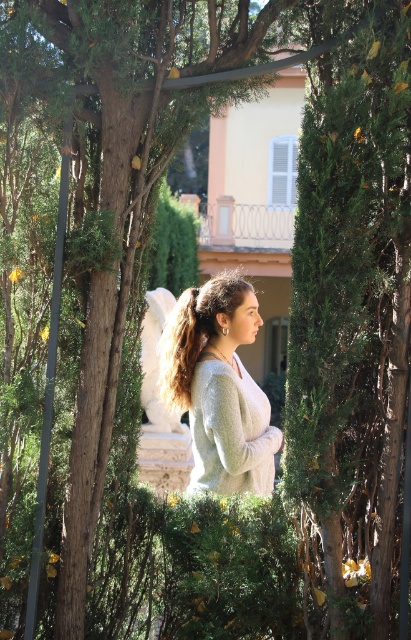
Question: Does light gray sweater at center appear on the right side of light gray knitted sweater at center?

Choices:
 (A) yes
 (B) no

Answer: (B)

Question: Is light gray sweater at center to the right of light gray knitted sweater at center from the viewer's perspective?

Choices:
 (A) yes
 (B) no

Answer: (B)

Question: Which point is closer to the camera?

Choices:
 (A) light gray knitted sweater at center
 (B) light gray sweater at center

Answer: (A)

Question: Is light gray sweater at center above light gray knitted sweater at center?

Choices:
 (A) no
 (B) yes

Answer: (B)